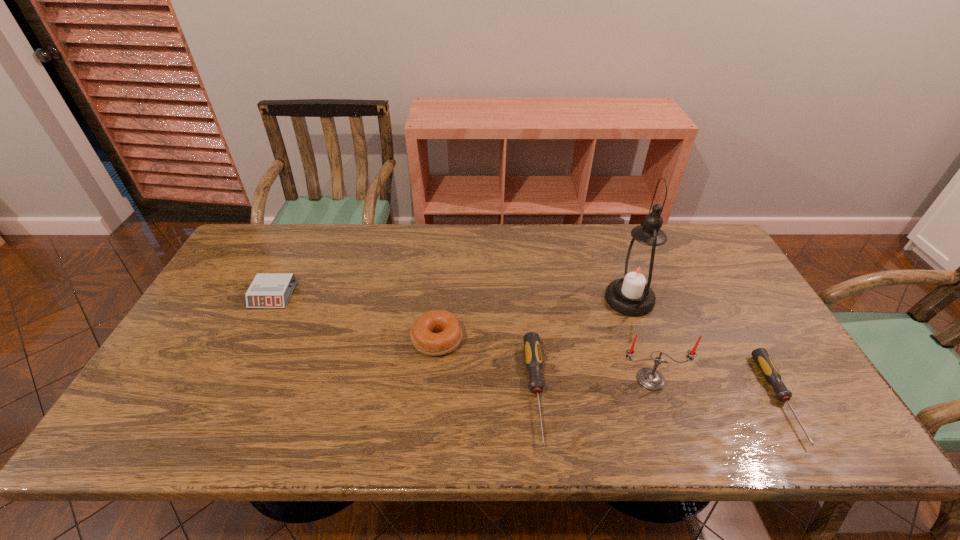
Where is `object that stands as the second closest to the leftmost object`? object that stands as the second closest to the leftmost object is located at coordinates (533, 357).